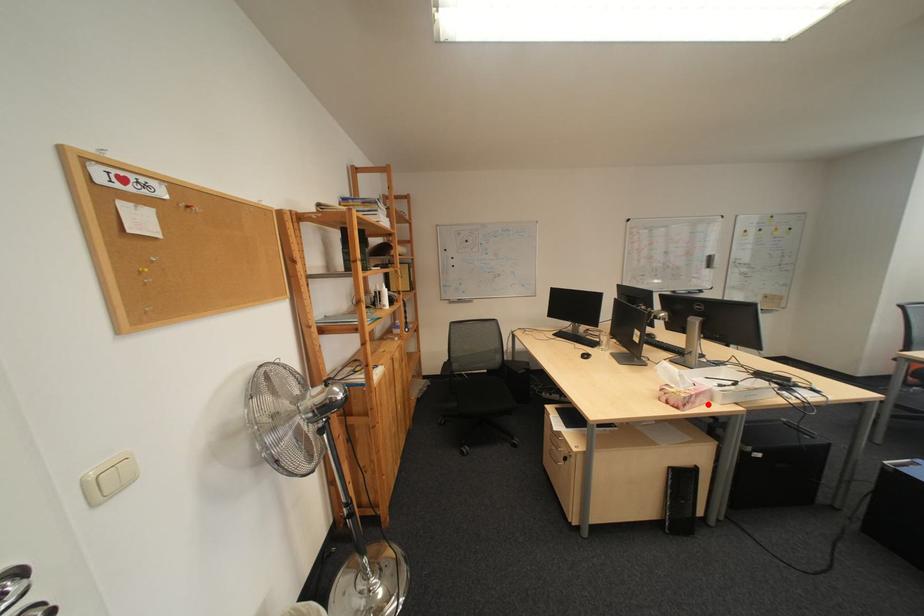
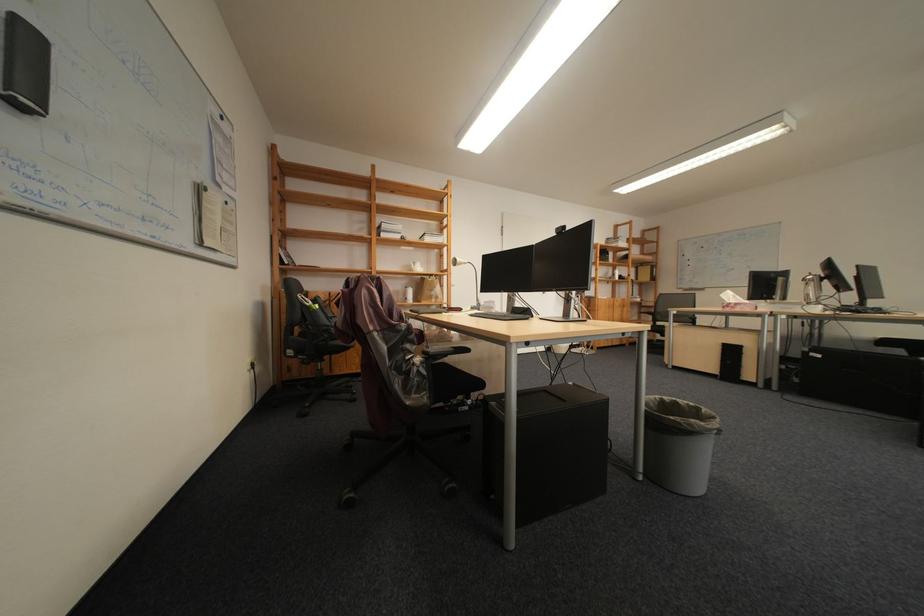
Locate, in the second image, the point that corresponds to the highlighted location in the first image.

(747, 309)